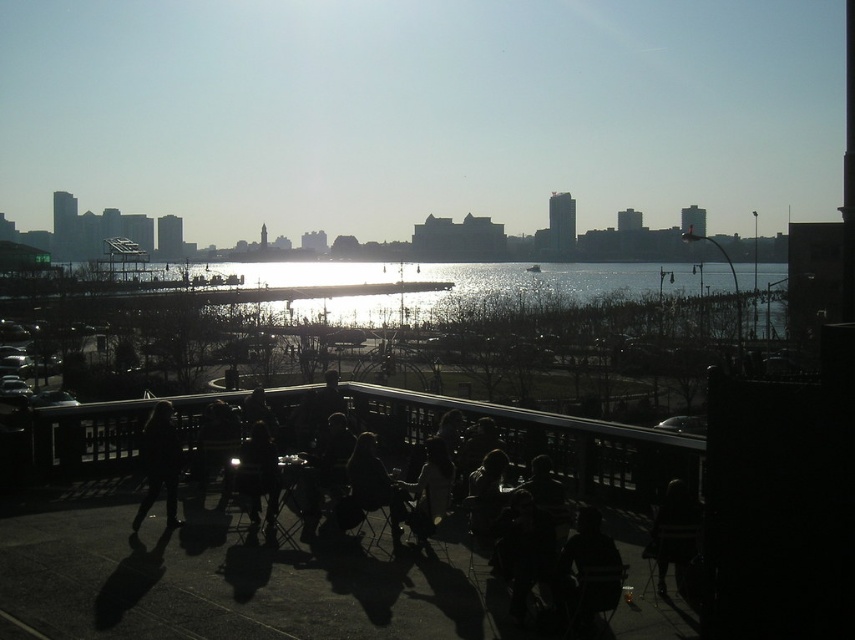
How far apart are silvery reflective water at center and black leather jacket at lower left?

They are 132.23 feet apart.

Who is more distant from viewer, (x=585, y=282) or (x=149, y=502)?

The point (x=585, y=282) is behind.

The width and height of the screenshot is (855, 640). In order to click on silvery reflective water at center in this screenshot , I will do `click(464, 285)`.

Is black leather jacket at lower left taller than dark fabric chair at center?

Indeed, black leather jacket at lower left has a greater height compared to dark fabric chair at center.

Who is taller, black leather jacket at lower left or dark fabric chair at center?

black leather jacket at lower left is taller.

Who is more forward, (171, 509) or (429, 486)?

Point (429, 486) is in front.

Identify the location of black leather jacket at lower left. This screenshot has height=640, width=855. (158, 464).

What do you see at coordinates (258, 474) in the screenshot? The width and height of the screenshot is (855, 640). I see `dark fabric jacket at center` at bounding box center [258, 474].

Is dark fabric jacket at center wider than dark fabric chair at center?

Incorrect, dark fabric jacket at center's width does not surpass dark fabric chair at center's.

Identify the location of dark fabric jacket at center. (258, 474).